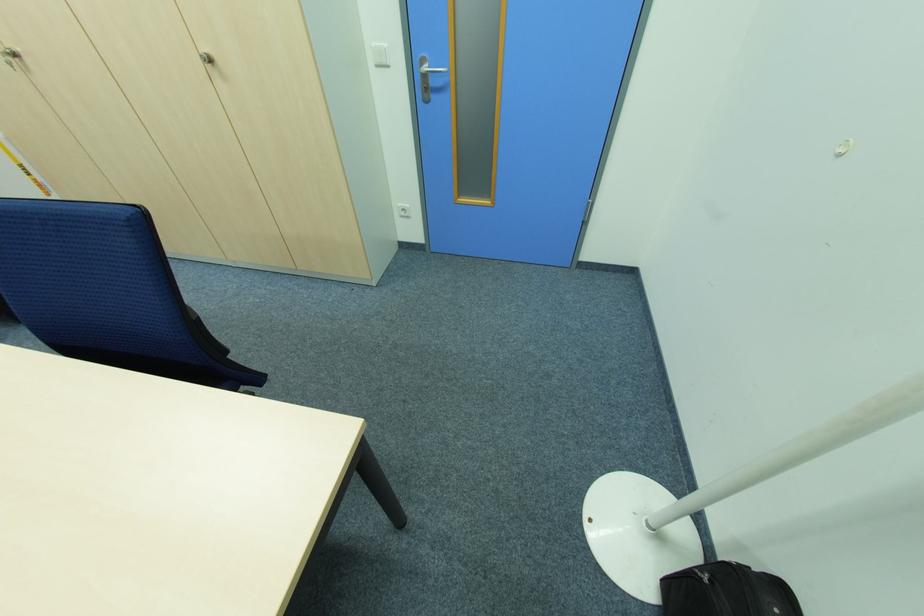
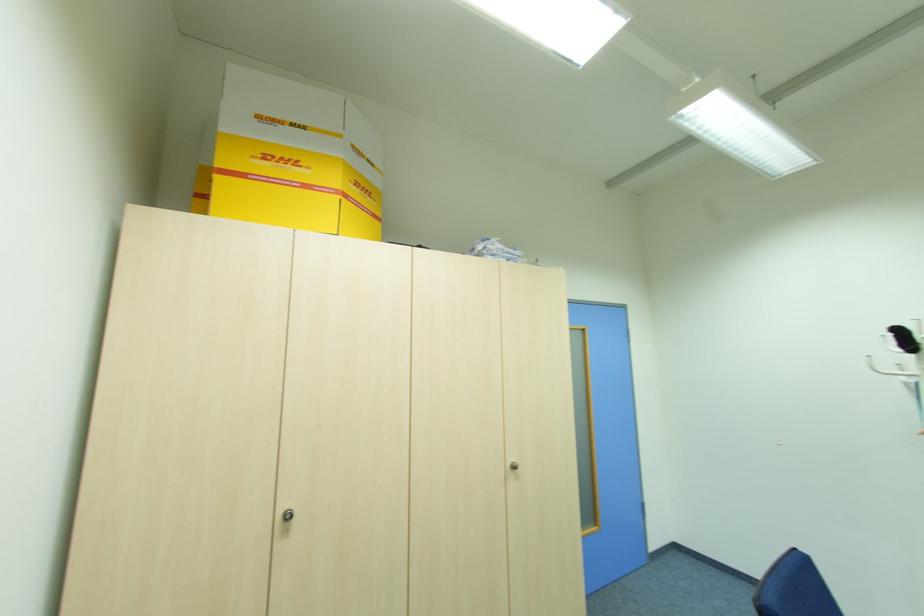
Locate, in the second image, the point that corresponds to pixel 208 51 in the first image.

(513, 460)